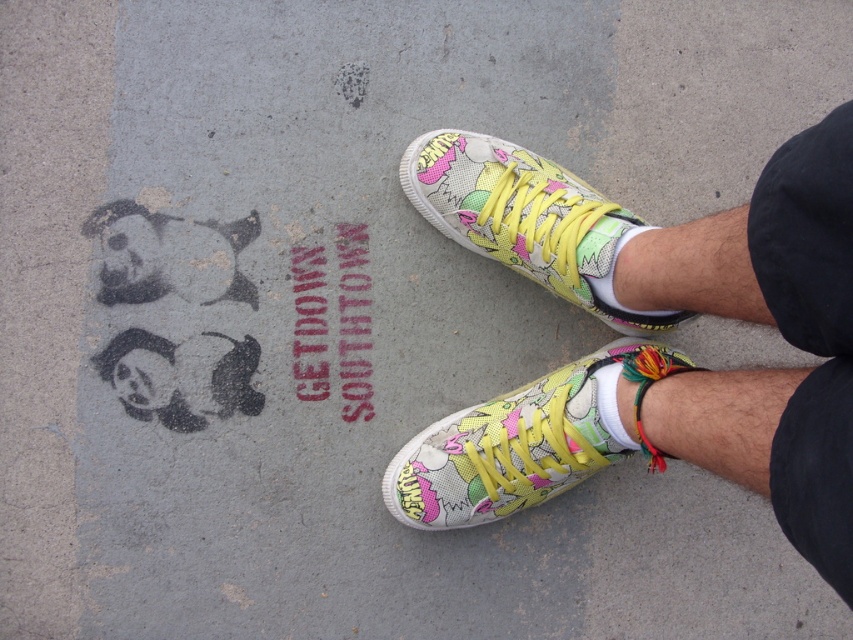
Is matte canvas sneakers at center above multicolored fabric sneaker at center?

No, matte canvas sneakers at center is not above multicolored fabric sneaker at center.

Between matte canvas sneakers at center and multicolored fabric sneaker at center, which one appears on the right side from the viewer's perspective?

matte canvas sneakers at center is more to the right.

I want to click on matte canvas sneakers at center, so click(651, 342).

Can you confirm if multicolored fabric sneaker at center is bigger than red stenciled text at center?

Yes.

Can you confirm if multicolored fabric sneaker at center is positioned to the left of red stenciled text at center?

In fact, multicolored fabric sneaker at center is to the right of red stenciled text at center.

Locate an element on the screen. multicolored fabric sneaker at center is located at coordinates (527, 220).

Does multicolored fabric sneaker at lower center have a greater height compared to red stenciled text at center?

No, multicolored fabric sneaker at lower center is not taller than red stenciled text at center.

Is the position of multicolored fabric sneaker at lower center more distant than that of red stenciled text at center?

No.

The image size is (853, 640). Describe the element at coordinates (520, 442) in the screenshot. I see `multicolored fabric sneaker at lower center` at that location.

The width and height of the screenshot is (853, 640). I want to click on multicolored fabric sneaker at lower center, so [x=520, y=442].